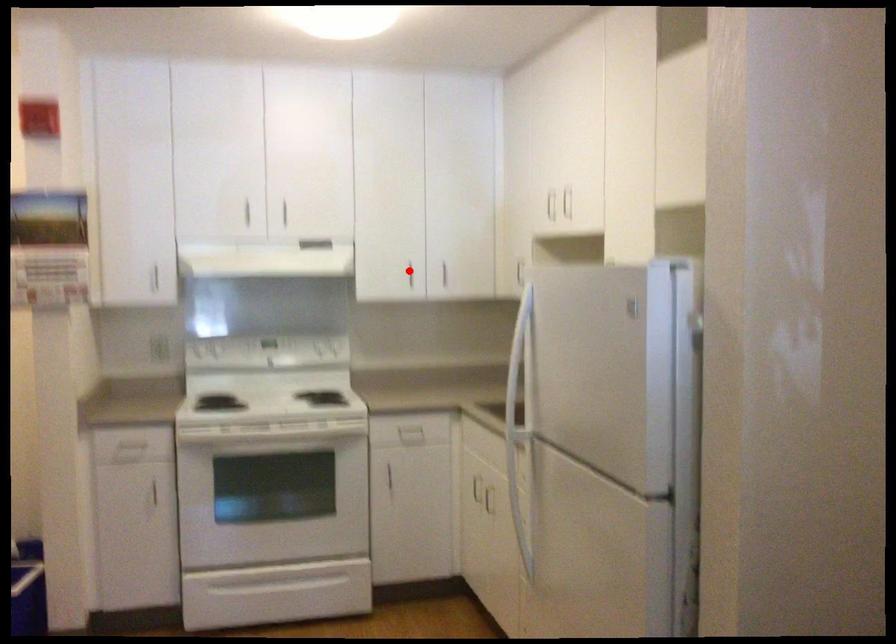
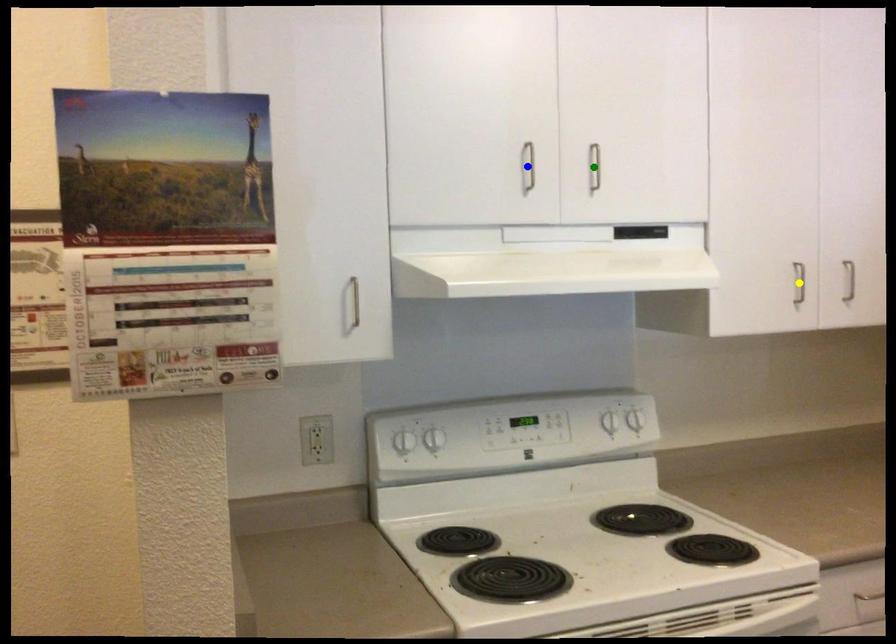
Question: I am providing you with two images of the same scene from different viewpoints. A red point is marked on the first image. You are given multiple points on the second image. Can you choose the point in image 2 that corresponds to the point in image 1?

Choices:
 (A) green point
 (B) blue point
 (C) yellow point

Answer: (C)